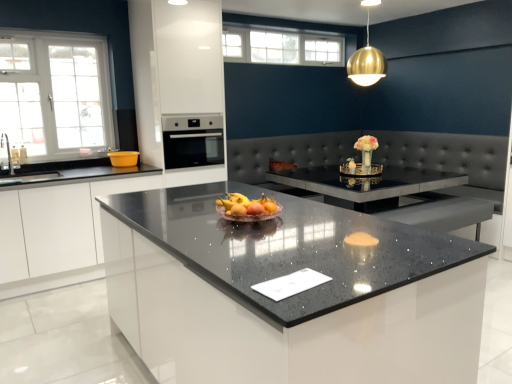
At what (x,y) coordinates should I click in order to perform the action: click on vacant space situated above white glass window at upper center, the 1th window positioned from the top (from a real-world perspective). Please return your answer as a coordinate pair (x, y). Looking at the image, I should click on (286, 32).